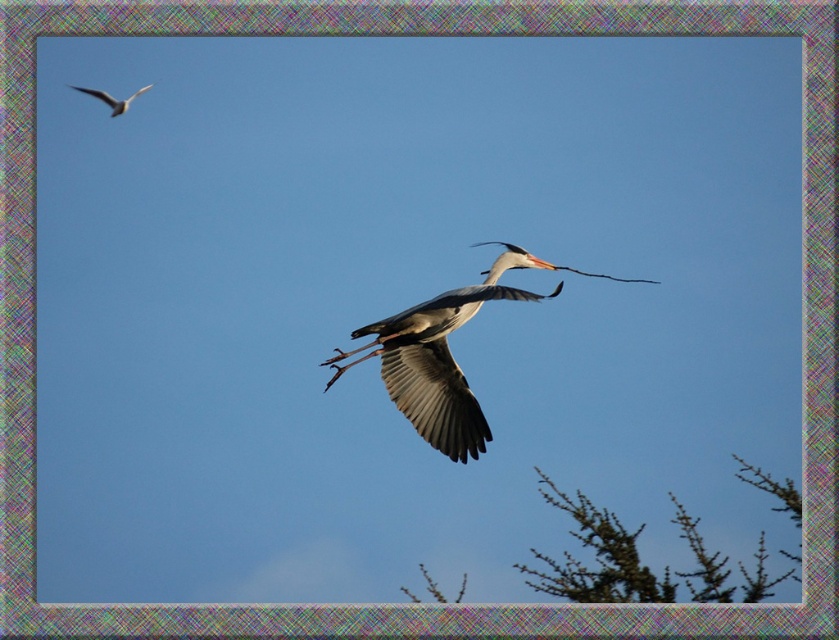
You are a photographer trying to capture a photo of the white glossy bird at upper left and the green textured branches at lower right in the same frame. Based on their positions, which object should you adjust your camera focus to first to ensure both are in the frame?

The green textured branches at lower right is to the right of the white glossy bird at upper left. To capture both in the same frame, adjust your camera focus to the white glossy bird at upper left first, then pan towards the right to include the green textured branches at lower right in the frame.

You are observing two birds in the sky. The gray matte bird at center and the white glossy bird at upper left. Which one is positioned more to the east if the sun is setting in the west?

The gray matte bird at center is positioned more to the east because it is to the right of the white glossy bird at upper left, and since the sun is setting in the west, right side would be east.

You are a photographer aiming to capture the bird in flight. You notice a specific point in the scene at coordinates point (580, 508). If your camera has a focal length of 50mm and you want to focus on this point, what is the approximate distance in meters between the camera and this point?

A: The point (580, 508) is 69.52 meters away from the camera, so the distance is approximately 69.52 meters.